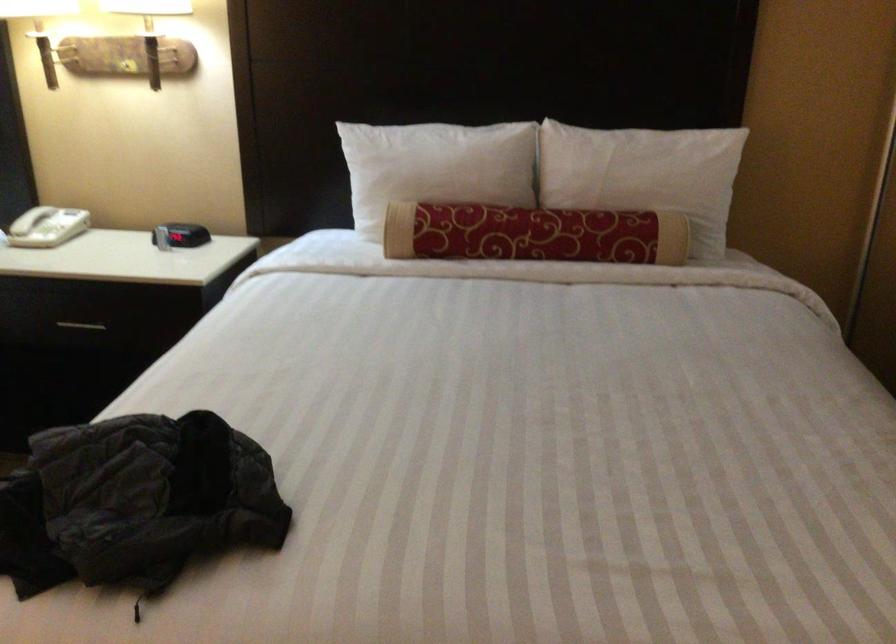
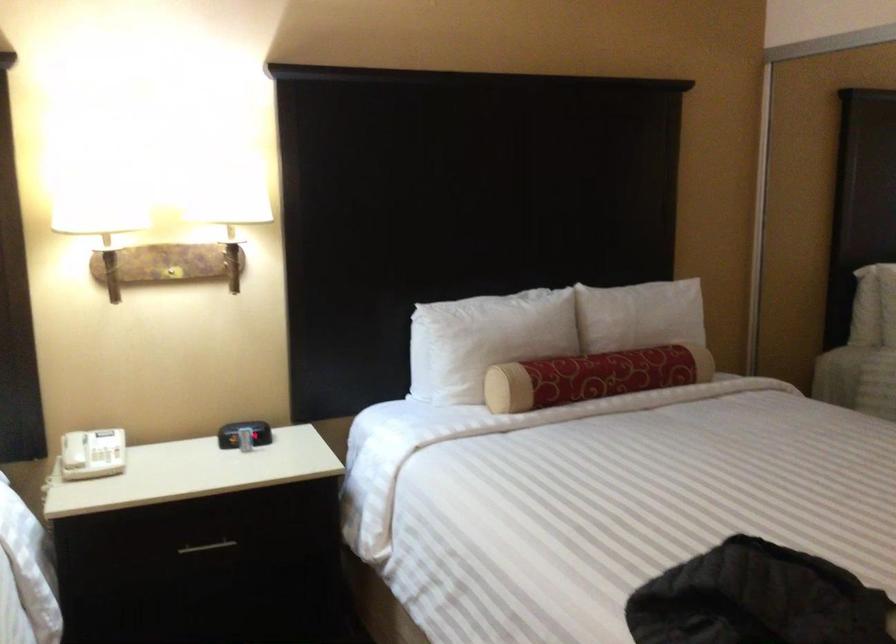
The point at (80, 323) is marked in the first image. Where is the corresponding point in the second image?

(207, 547)